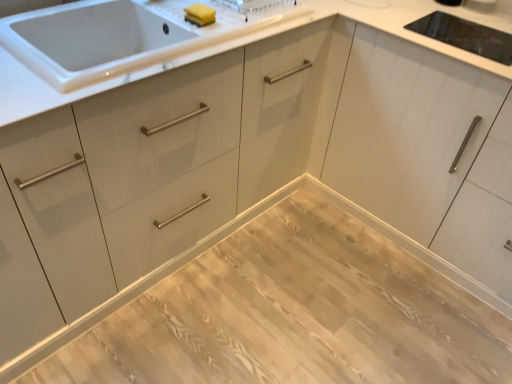
This screenshot has height=384, width=512. What are the coordinates of `vacant area that is in front of yellow sponge at upper center` in the screenshot? It's located at (197, 41).